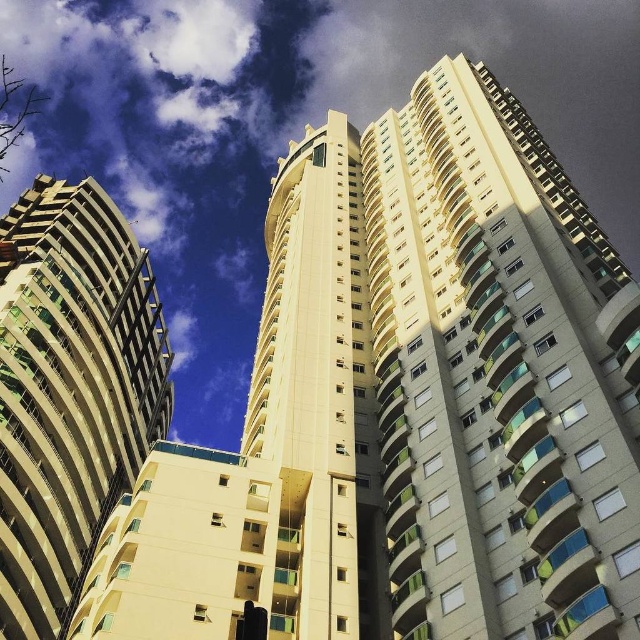
Measure the distance from beige concrete building at left to beige concrete tower at center.

beige concrete building at left and beige concrete tower at center are 103.21 feet apart from each other.

Is beige concrete building at left thinner than beige concrete tower at center?

No, beige concrete building at left is not thinner than beige concrete tower at center.

Who is more distant from viewer, (100, 401) or (312, 365)?

The point (100, 401) is behind.

Image resolution: width=640 pixels, height=640 pixels. Find the location of `beige concrete building at left`. beige concrete building at left is located at coordinates (70, 392).

Who is positioned more to the right, smooth beige building at center or beige concrete building at left?

Positioned to the right is smooth beige building at center.

This screenshot has width=640, height=640. What do you see at coordinates (269, 451) in the screenshot?
I see `smooth beige building at center` at bounding box center [269, 451].

Locate an element on the screen. The width and height of the screenshot is (640, 640). smooth beige building at center is located at coordinates (269, 451).

Locate an element on the screen. Image resolution: width=640 pixels, height=640 pixels. smooth beige building at center is located at coordinates (269, 451).

Can you confirm if matte yellow building at upper right is positioned below smooth beige building at center?

Incorrect, matte yellow building at upper right is not positioned below smooth beige building at center.

Who is more distant from viewer, (586, 525) or (342, 522)?

The point (342, 522) is more distant.

Between point (472, 106) and point (312, 595), which one is positioned behind?

Positioned behind is point (472, 106).

Find the location of a particular element. This screenshot has height=640, width=640. matte yellow building at upper right is located at coordinates (497, 374).